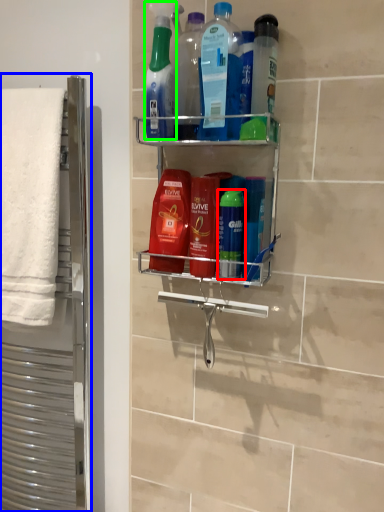
Question: Estimate the real-world distances between objects in this image. Which object is farther from mouthwash (highlighted by a red box), screen door (highlighted by a blue box) or cleaning product (highlighted by a green box)?

Choices:
 (A) screen door
 (B) cleaning product

Answer: (A)